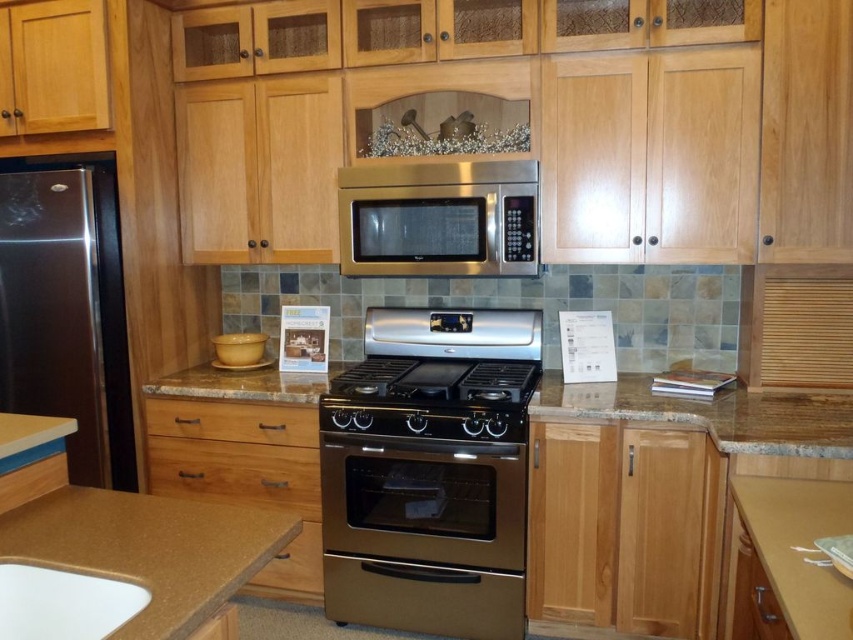
From the picture: Which of these two, white glossy sink at lower left or stainless steel gas stove at center, stands taller?

With more height is white glossy sink at lower left.

Is point (90, 577) farther from camera compared to point (407, 376)?

That is False.

What do you see at coordinates (62, 602) in the screenshot? The width and height of the screenshot is (853, 640). I see `white glossy sink at lower left` at bounding box center [62, 602].

At what (x,y) coordinates should I click in order to perform the action: click on white glossy sink at lower left. Please return your answer as a coordinate pair (x, y). Image resolution: width=853 pixels, height=640 pixels. Looking at the image, I should click on (62, 602).

Who is more forward, (383, 611) or (225, 429)?

Positioned in front is point (383, 611).

At what (x,y) coordinates should I click in order to perform the action: click on stainless steel oven at center. Please return your answer as a coordinate pair (x, y). This screenshot has height=640, width=853. Looking at the image, I should click on (424, 534).

Where is `stainless steel oven at center`? The height and width of the screenshot is (640, 853). stainless steel oven at center is located at coordinates (424, 534).

This screenshot has width=853, height=640. Describe the element at coordinates (67, 310) in the screenshot. I see `satin stainless steel refrigerator at left` at that location.

Who is shorter, satin stainless steel refrigerator at left or wooden drawer at lower left?

wooden drawer at lower left

Is point (115, 337) farther from camera compared to point (171, 428)?

No, (115, 337) is closer to viewer.

Image resolution: width=853 pixels, height=640 pixels. I want to click on satin stainless steel refrigerator at left, so click(67, 310).